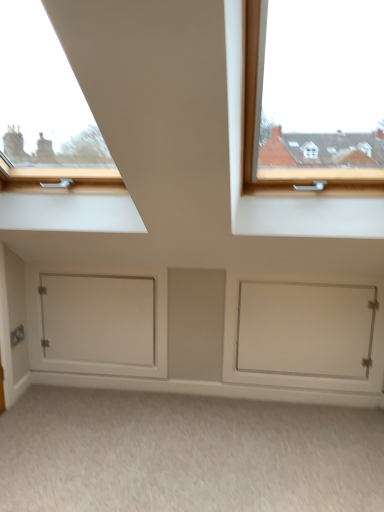
Question: Is beige carpet at lower center positioned beyond the bounds of white matte door at lower right, the first door when ordered from right to left?

Choices:
 (A) yes
 (B) no

Answer: (A)

Question: Considering the relative sizes of beige carpet at lower center and white matte door at lower right, the first door when ordered from right to left, in the image provided, is beige carpet at lower center bigger than white matte door at lower right, the first door when ordered from right to left,?

Choices:
 (A) no
 (B) yes

Answer: (B)

Question: From the image's perspective, is beige carpet at lower center beneath white matte door at lower right, which is the second door in left-to-right order?

Choices:
 (A) no
 (B) yes

Answer: (B)

Question: Is beige carpet at lower center further to camera compared to white matte door at lower right, which is the second door in left-to-right order?

Choices:
 (A) no
 (B) yes

Answer: (A)

Question: Can you confirm if beige carpet at lower center is wider than white matte door at lower right, which is the second door in left-to-right order?

Choices:
 (A) yes
 (B) no

Answer: (A)

Question: Looking at their shapes, would you say white matte door at lower left, the first door when ordered from left to right, is wider or thinner than white matte door at lower right, the first door when ordered from right to left?

Choices:
 (A) wide
 (B) thin

Answer: (B)

Question: In terms of height, does white matte door at lower left, the first door when ordered from left to right, look taller or shorter compared to white matte door at lower right, which is the second door in left-to-right order?

Choices:
 (A) short
 (B) tall

Answer: (A)

Question: From a real-world perspective, relative to white matte door at lower right, the first door when ordered from right to left, is white matte door at lower left, which is the 2th door in right-to-left order, vertically above or below?

Choices:
 (A) above
 (B) below

Answer: (A)

Question: Based on their positions, is white matte door at lower left, which is the 2th door in right-to-left order, located to the left or right of white matte door at lower right, the first door when ordered from right to left?

Choices:
 (A) left
 (B) right

Answer: (A)

Question: In terms of height, does beige carpet at lower center look taller or shorter compared to white matte door at lower left, which is the 2th door in right-to-left order?

Choices:
 (A) tall
 (B) short

Answer: (B)

Question: Is point (281, 408) closer or farther from the camera than point (125, 360)?

Choices:
 (A) closer
 (B) farther

Answer: (A)

Question: Considering the relative positions of beige carpet at lower center and white matte door at lower left, which is the 2th door in right-to-left order, in the image provided, is beige carpet at lower center to the left or to the right of white matte door at lower left, which is the 2th door in right-to-left order,?

Choices:
 (A) right
 (B) left

Answer: (A)

Question: In terms of size, does beige carpet at lower center appear bigger or smaller than white matte door at lower left, which is the 2th door in right-to-left order?

Choices:
 (A) small
 (B) big

Answer: (B)

Question: Is white matte door at lower right, the first door when ordered from right to left, inside the boundaries of beige carpet at lower center, or outside?

Choices:
 (A) inside
 (B) outside

Answer: (B)

Question: Considering the positions of point (364, 312) and point (198, 485), is point (364, 312) closer or farther from the camera than point (198, 485)?

Choices:
 (A) farther
 (B) closer

Answer: (A)